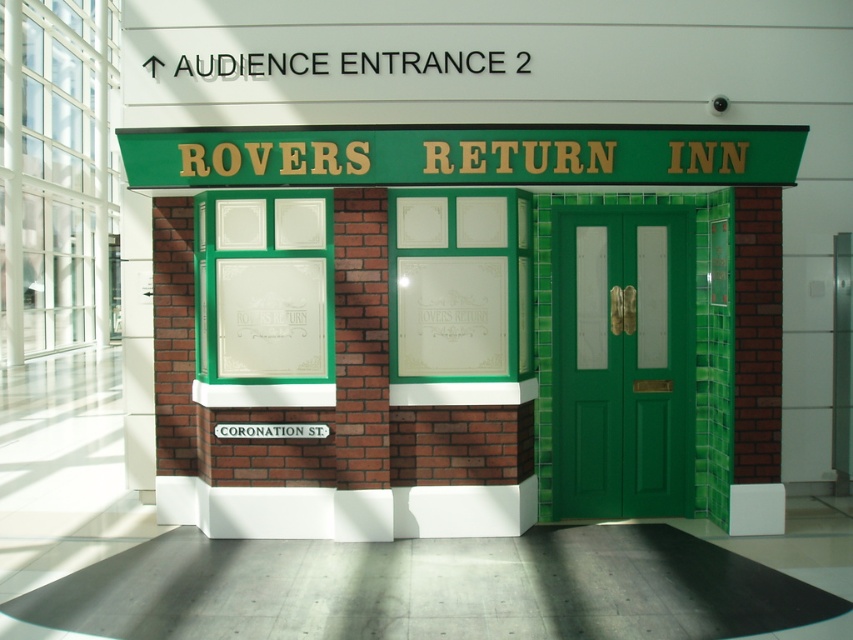
Question: Where is green wooden door at center located in relation to black plastic sign at upper center in the image?

Choices:
 (A) right
 (B) left

Answer: (A)

Question: Does green brick storefront at center appear over black plastic sign at upper center?

Choices:
 (A) yes
 (B) no

Answer: (B)

Question: Among these points, which one is nearest to the camera?

Choices:
 (A) (367, 61)
 (B) (646, 241)
 (C) (735, 145)

Answer: (C)

Question: Which object is positioned farthest from the black plastic sign at upper center?

Choices:
 (A) green wooden door at center
 (B) green brick storefront at center

Answer: (A)

Question: Which point is farther to the camera?

Choices:
 (A) green wooden door at center
 (B) green brick storefront at center

Answer: (A)

Question: Can you confirm if green wooden door at center is positioned to the right of black plastic sign at upper center?

Choices:
 (A) yes
 (B) no

Answer: (A)